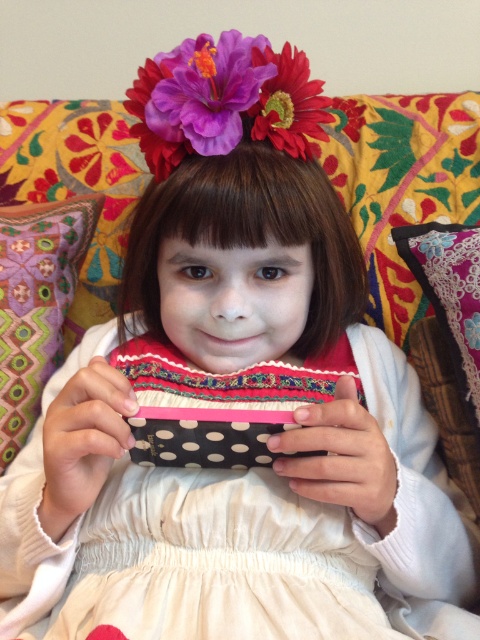
Is multicolored fabric pillow at lower left positioned behind vibrant matte flower at center?

Yes, it is.

Does multicolored fabric pillow at lower left have a larger size compared to vibrant matte flower at center?

Indeed, multicolored fabric pillow at lower left has a larger size compared to vibrant matte flower at center.

Is point (70, 228) positioned before point (277, 116)?

No.

What are the coordinates of `multicolored fabric pillow at lower left` in the screenshot? It's located at (36, 301).

Can you confirm if purple fabric flower at upper center is positioned to the right of floral fabric pillow at upper right?

No, purple fabric flower at upper center is not to the right of floral fabric pillow at upper right.

Who is more forward, (226, 52) or (443, 230)?

Point (226, 52) is more forward.

Measure the distance between point [289,51] and camera.

They are 22.17 inches apart.

I want to click on purple fabric flower at upper center, so click(224, 99).

Does white satin dress at center appear on the right side of multicolored fabric pillow at lower left?

Yes, white satin dress at center is to the right of multicolored fabric pillow at lower left.

Does white satin dress at center have a lesser width compared to multicolored fabric pillow at lower left?

Incorrect, white satin dress at center's width is not less than multicolored fabric pillow at lower left's.

Is point (278, 618) positioned after point (48, 330)?

That is False.

Find the location of `white satin dress at center`. white satin dress at center is located at coordinates (228, 561).